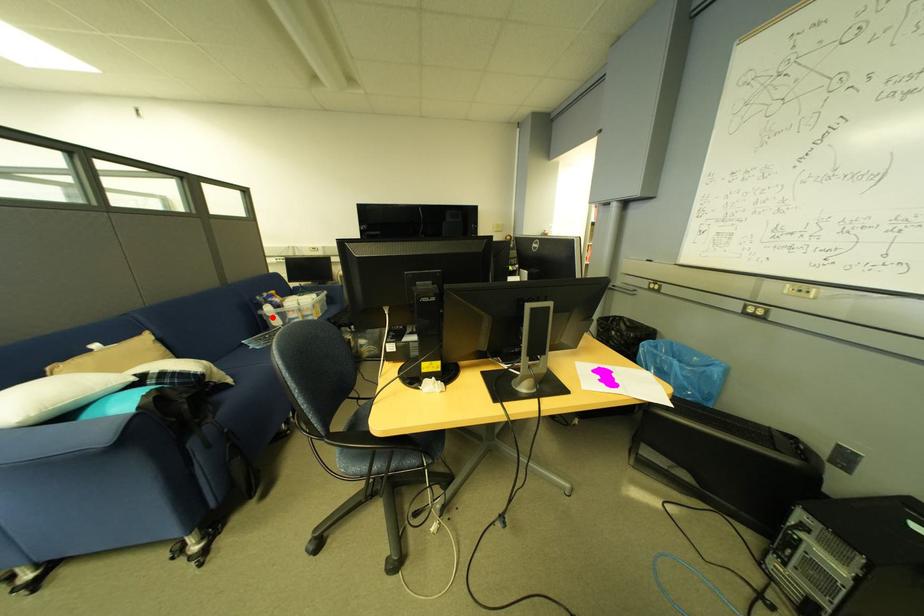
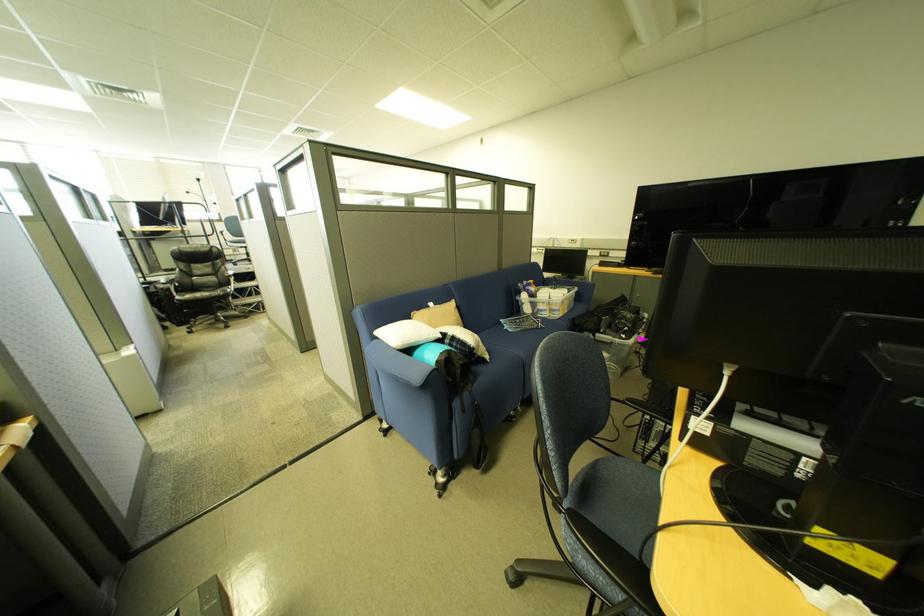
Question: I am providing you with two images of the same scene from different viewpoints. Image1 has a red point marked. In image2, the corresponding 3D location appears at what relative position? Reply with the corresponding letter.

Choices:
 (A) Closer
 (B) Farther

Answer: (A)